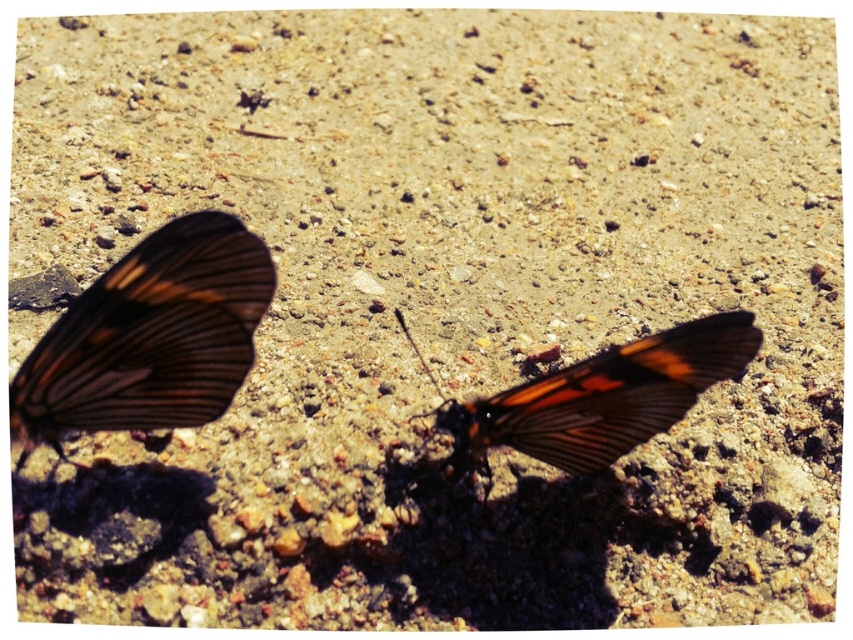
Is shiny brown butterfly at left thinner than orange-patterned wing at center?

Indeed, shiny brown butterfly at left has a lesser width compared to orange-patterned wing at center.

Does point (161, 256) come in front of point (618, 380)?

Yes.

Between point (216, 321) and point (735, 324), which one is positioned behind?

Positioned behind is point (735, 324).

The image size is (853, 640). I want to click on shiny brown butterfly at left, so click(149, 337).